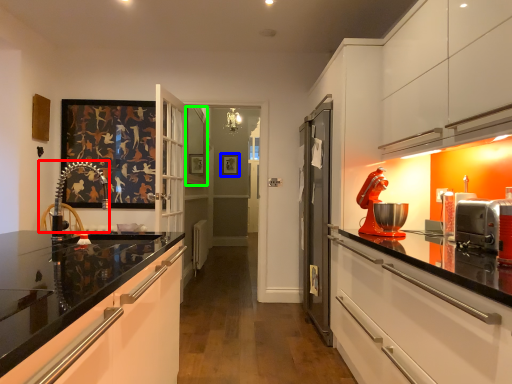
Question: Which object is the closest to the chair (highlighted by a red box)? Choose among these: picture frame (highlighted by a blue box) or window (highlighted by a green box).

Choices:
 (A) picture frame
 (B) window

Answer: (B)